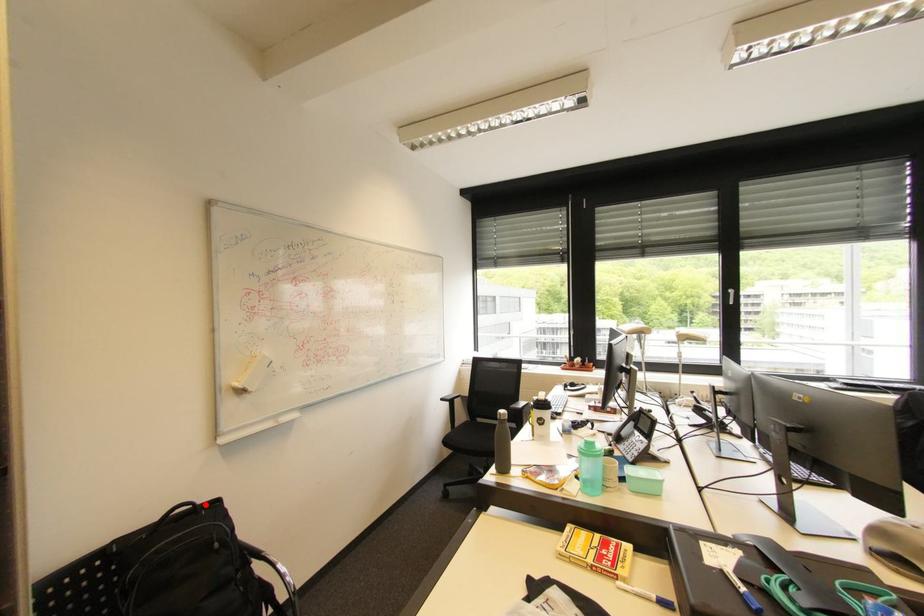
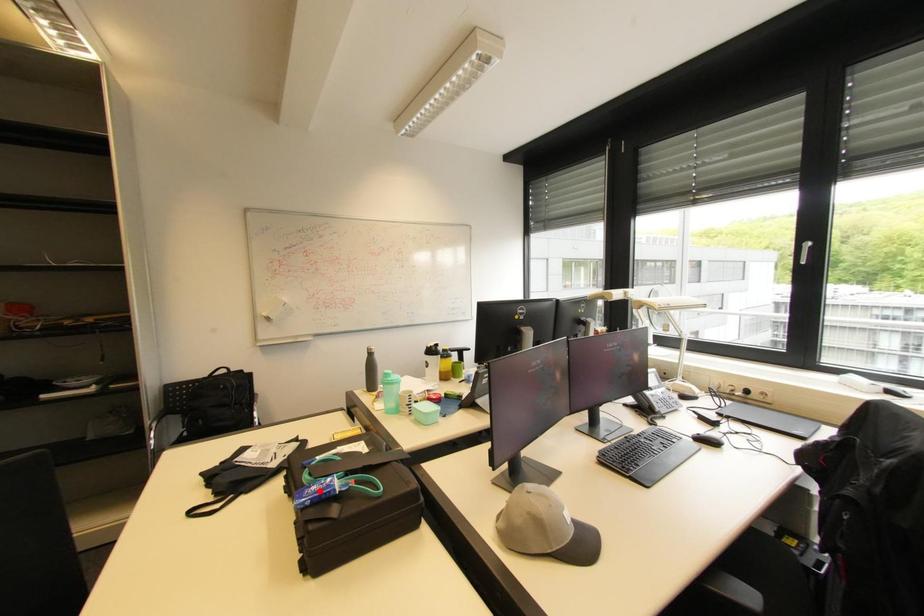
I am providing you with two images of the same scene from different viewpoints. A red point is marked on the first image and another point is marked on the second image. Do the highlighted points in image1 and image2 indicate the same real-world spot?

No